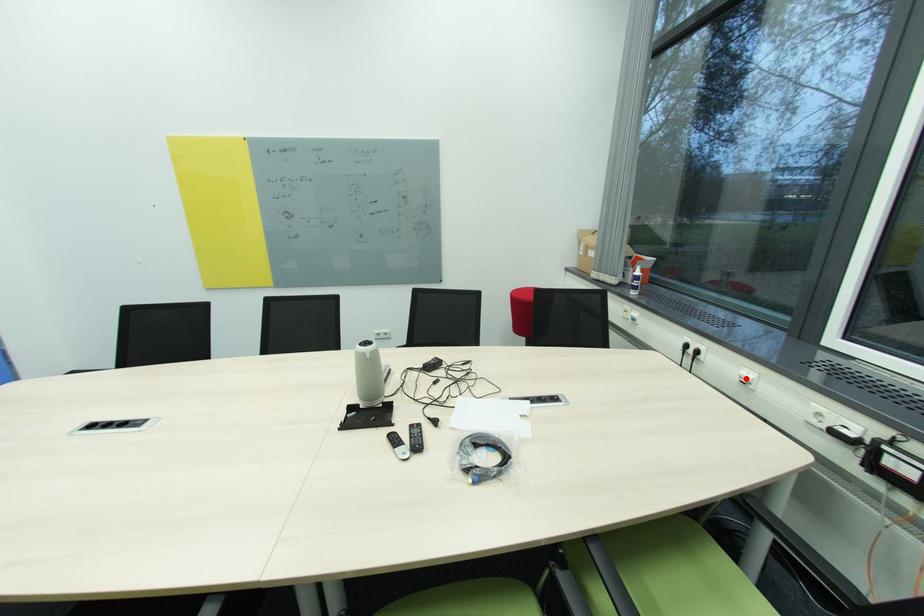
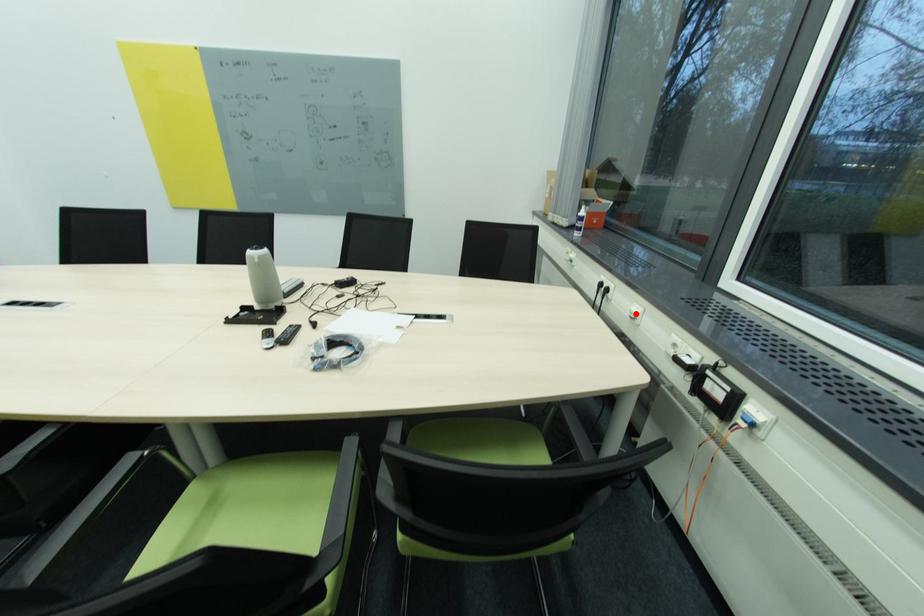
I am providing you with two images of the same scene from different viewpoints. A red point is marked on the first image and another point is marked on the second image. Are the points marked in image1 and image2 representing the same 3D position?

Yes